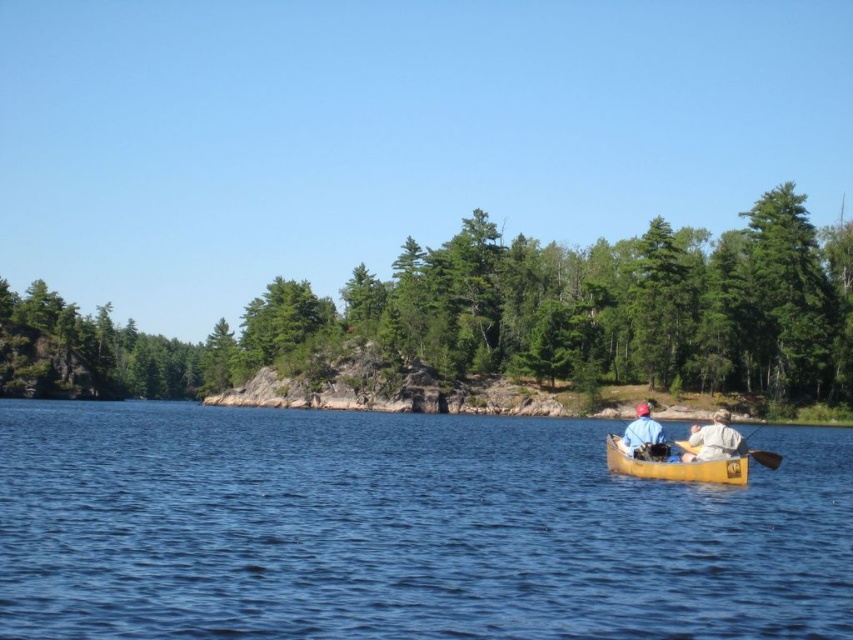
You are standing at the point marked by coordinates point (677,467). Looking around, you see the yellow wood canoe at lower center. Is the canoe located to the left or right of your current position?

The point (677,467) marks the yellow wood canoe at lower center, so the canoe is exactly at your current position.

You are standing at the point marked by the coordinates point (x=508, y=316) in the image. Looking around, you see the green leafy trees at center. What direction should you face to see the yellow canoe on the right side of the frame?

The point (x=508, y=316) is on the green leafy trees at center. Since the yellow canoe is on the right side of the frame, you should face towards the right direction to see it.

You are standing on the shore of the lake and see the green leafy trees at center and the wooden paddle at center in the canoe. Which object is higher from your viewpoint?

The green leafy trees at center are positioned over the wooden paddle at center, so they are higher from your viewpoint.